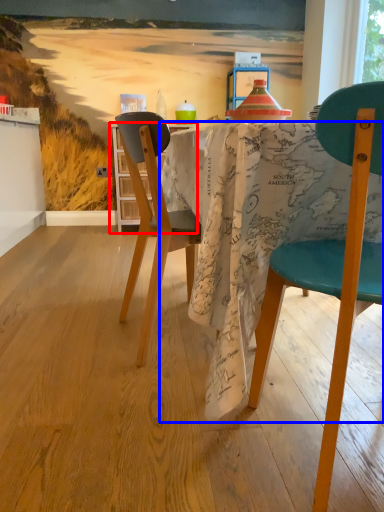
Question: Which object is closer to the camera taking this photo, kitchen & dining room table (highlighted by a red box) or desk (highlighted by a blue box)?

Choices:
 (A) kitchen & dining room table
 (B) desk

Answer: (B)